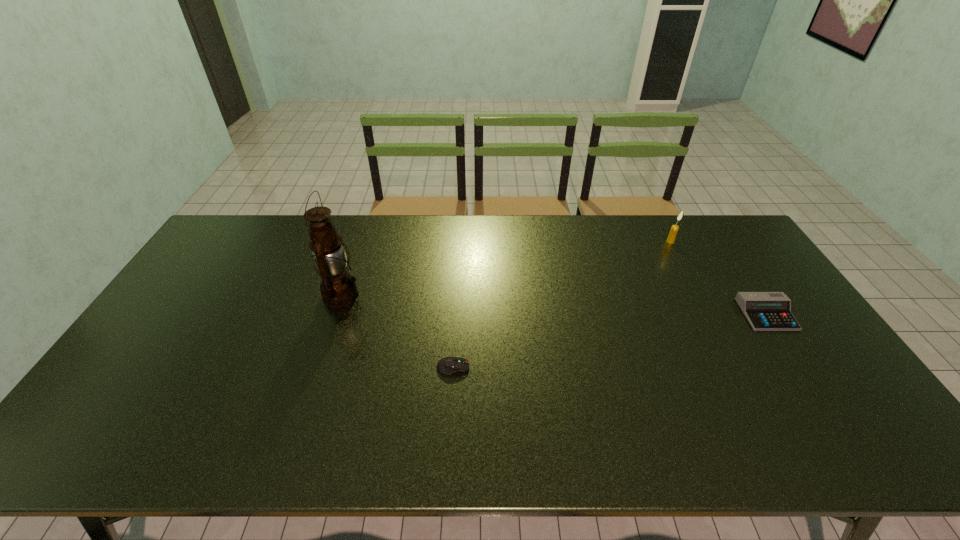
Image resolution: width=960 pixels, height=540 pixels. What are the coordinates of `object that is the second closest one to the leftmost object` in the screenshot? It's located at (674, 229).

The height and width of the screenshot is (540, 960). Find the location of `vacant space that satisfies the following two spatial constraints: 1. on the front side of the oil lamp; 2. on the left side of the calculator`. vacant space that satisfies the following two spatial constraints: 1. on the front side of the oil lamp; 2. on the left side of the calculator is located at coordinates (335, 314).

You are a GUI agent. You are given a task and a screenshot of the screen. Output one action in this format:
    pyautogui.click(x=<x>, y=<y>)
    Task: Click on the free spot that satisfies the following two spatial constraints: 1. on the front side of the third tallest object; 2. on the right side of the oil lamp
    This screenshot has height=540, width=960.
    Given the screenshot: What is the action you would take?
    coord(335,314)